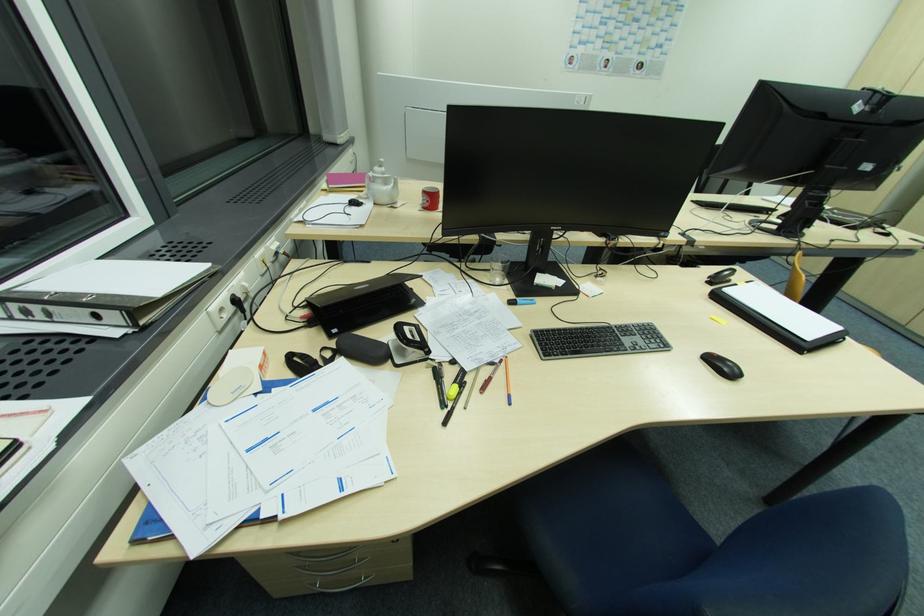
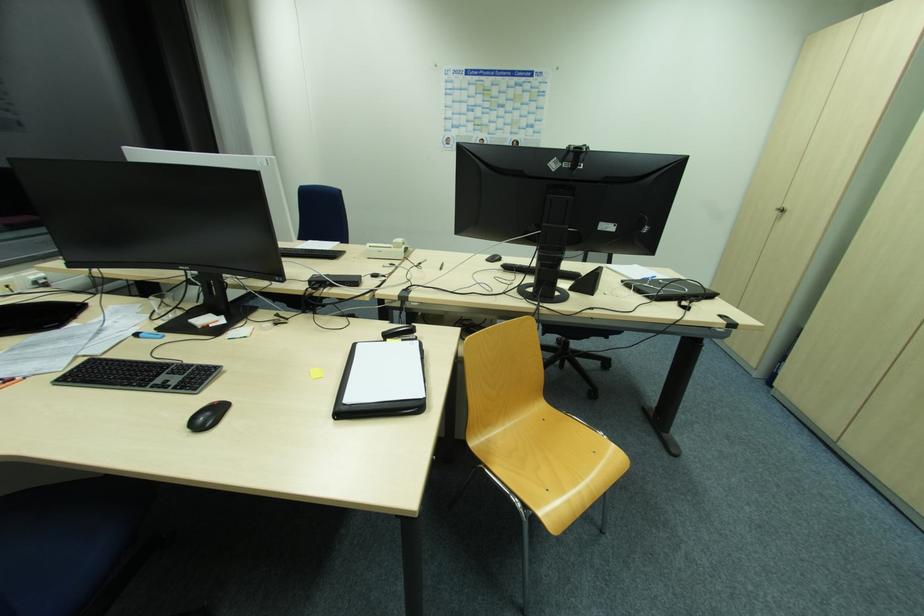
In the second image, find the point that corresponds to (738,286) in the first image.

(387, 342)